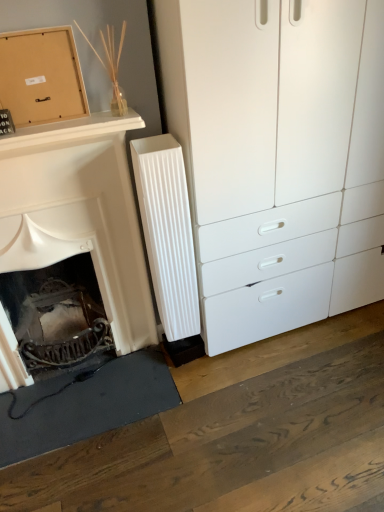
Where is `vacant area that is in front of white ribbed radiator at center`? The width and height of the screenshot is (384, 512). vacant area that is in front of white ribbed radiator at center is located at coordinates (189, 385).